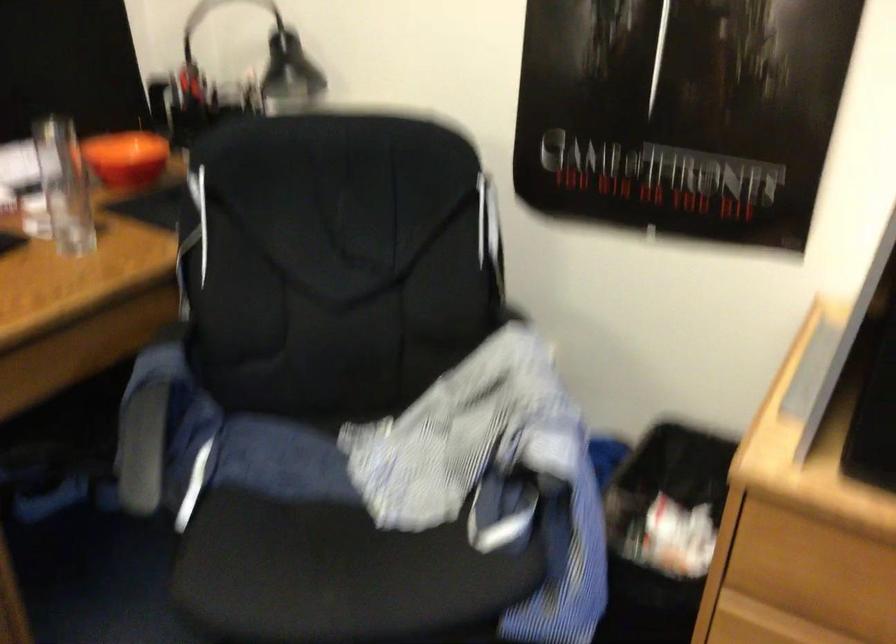
The first image is from the beginning of the video and the second image is from the end. How did the camera likely rotate when shooting the video?

The camera rotated toward right-down.